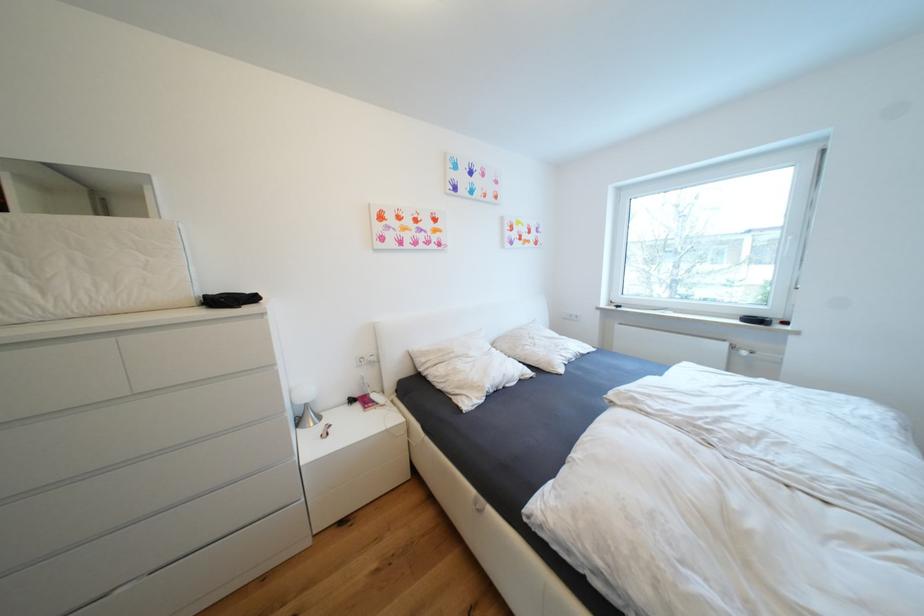
What do you see at coordinates (740, 350) in the screenshot?
I see `the radiator valve` at bounding box center [740, 350].